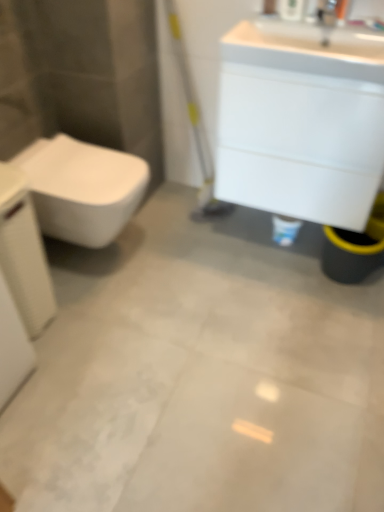
Question: From the image's perspective, relative to white textured porcelain at left, is white glossy cabinet at upper right above or below?

Choices:
 (A) below
 (B) above

Answer: (B)

Question: Considering the positions of white glossy cabinet at upper right and white textured porcelain at left in the image, is white glossy cabinet at upper right taller or shorter than white textured porcelain at left?

Choices:
 (A) short
 (B) tall

Answer: (A)

Question: Which object is positioned farthest from the white glossy sink at upper right?

Choices:
 (A) white textured porcelain at left
 (B) white glossy cabinet at upper right
 (C) silver metallic faucet at upper right
 (D) white glossy toilet at left

Answer: (A)

Question: Estimate the real-world distances between objects in this image. Which object is closer to the white glossy sink at upper right?

Choices:
 (A) white glossy cabinet at upper right
 (B) white glossy toilet at left
 (C) silver metallic faucet at upper right
 (D) white textured porcelain at left

Answer: (A)